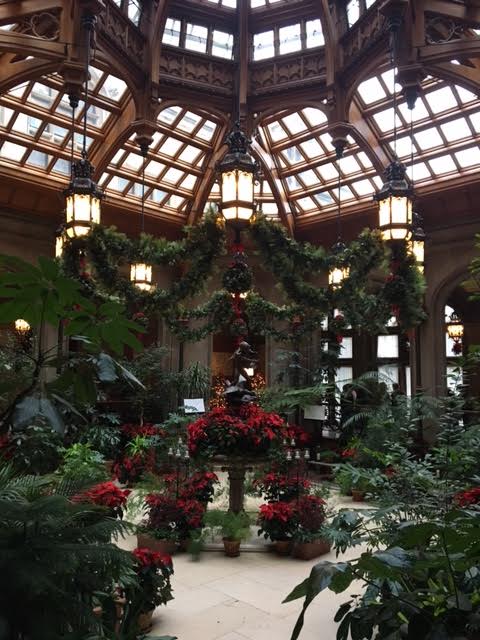
Locate an element on the screen. The height and width of the screenshot is (640, 480). ornate carved wood panels around center dome of ceiling is located at coordinates (197, 61), (287, 68), (367, 31), (112, 27).